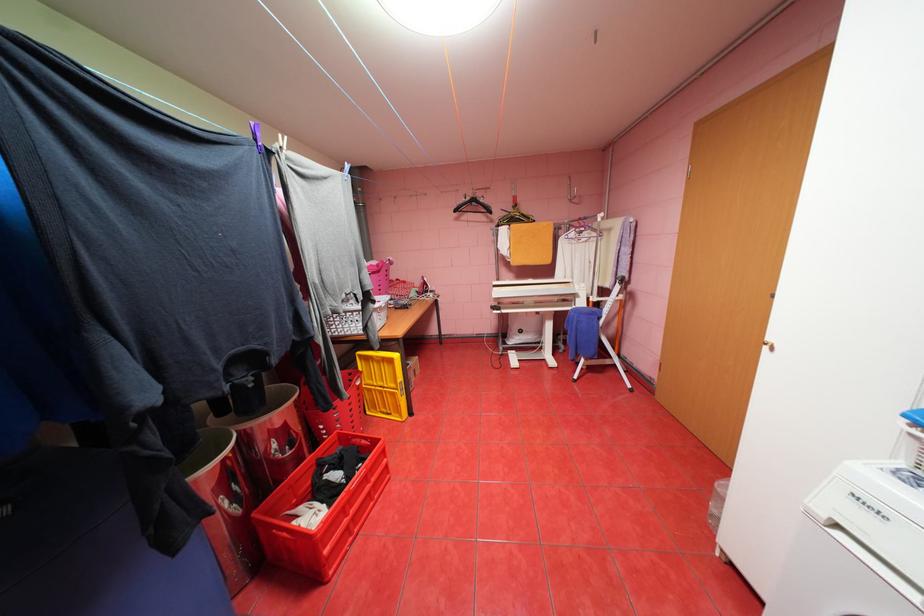
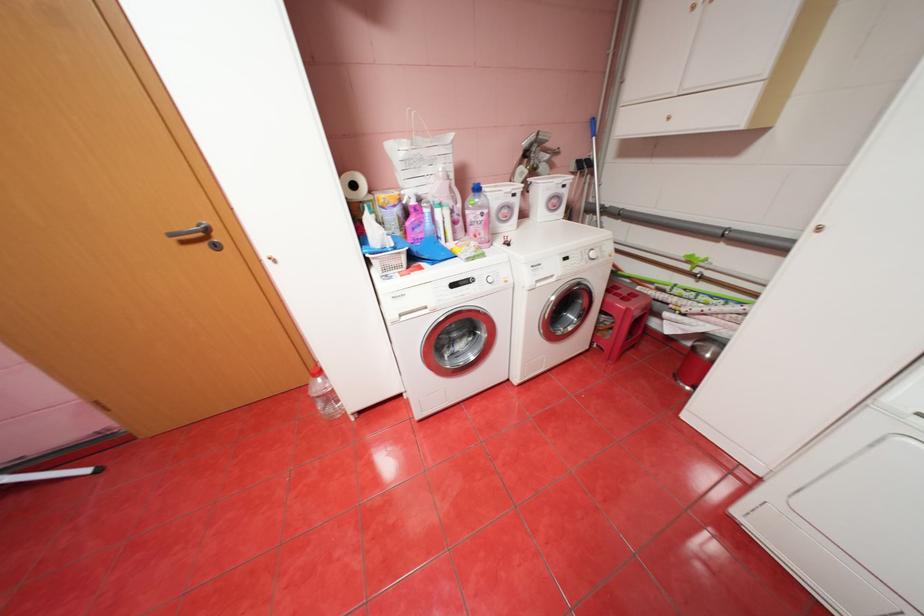
Based on the continuous images, in which direction is the camera rotating?

The camera rotated toward right-down.